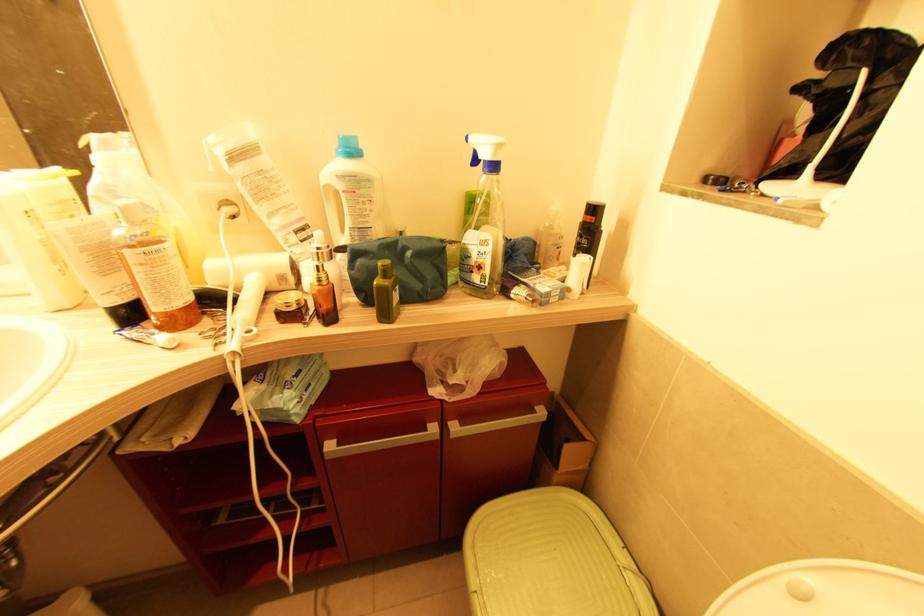
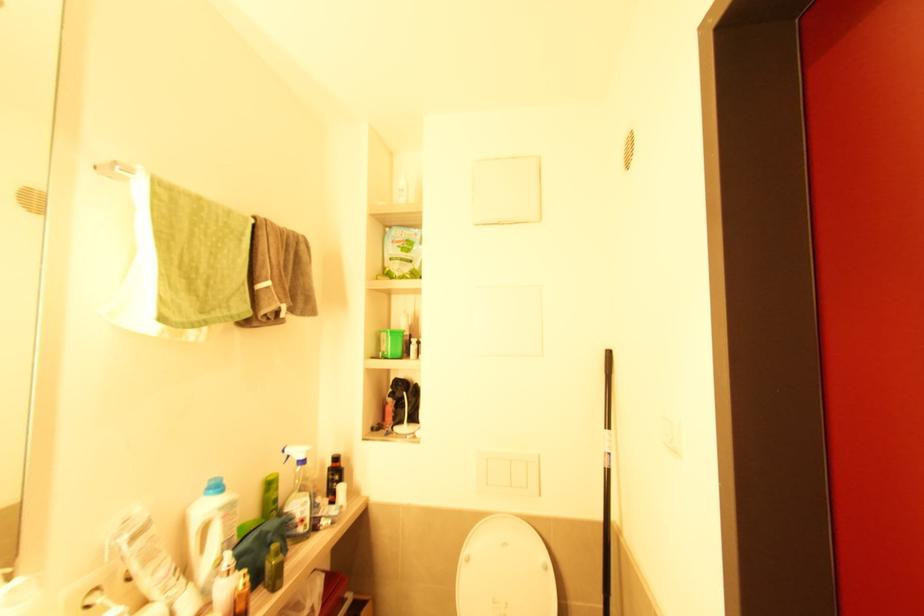
The point at (473,273) is marked in the first image. Where is the corresponding point in the second image?

(298, 527)